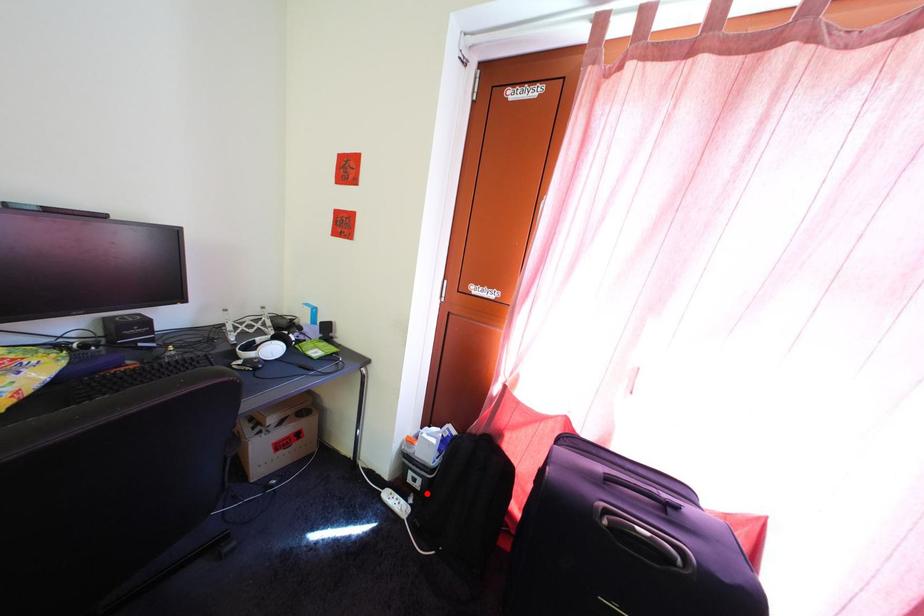
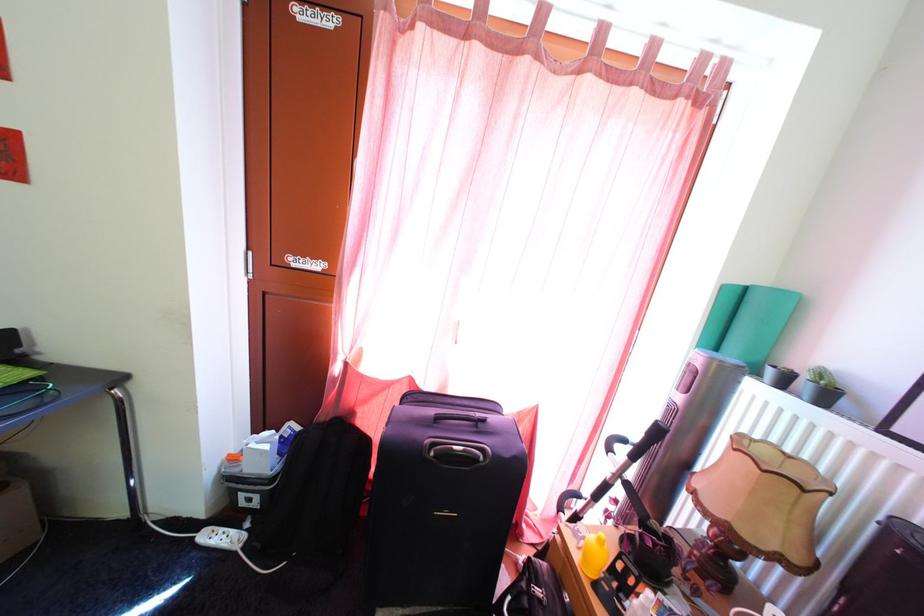
Question: I am providing you with two images of the same scene from different viewpoints. Image1 has a red point marked. In image2, the corresponding 3D location appears at what relative position? Reply with the corresponding letter.

Choices:
 (A) Closer
 (B) Farther

Answer: (A)